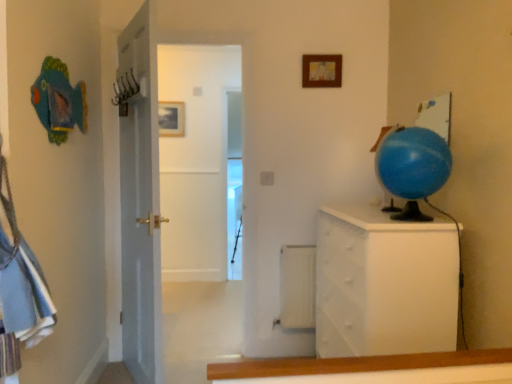
Question: Would you say matte gold picture frame at upper center, positioned as the first picture frame in back-to-front order, is inside or outside white textured chest of drawers at right?

Choices:
 (A) outside
 (B) inside

Answer: (A)

Question: Relative to white textured chest of drawers at right, is matte gold picture frame at upper center, which is the 2th picture frame in right-to-left order, in front or behind?

Choices:
 (A) behind
 (B) front

Answer: (A)

Question: Estimate the real-world distances between objects in this image. Which object is closer to the wooden picture frame at upper center, placed as the 1th picture frame when sorted from front to back?

Choices:
 (A) matte gold picture frame at upper center, marked as the 2th picture frame in a front-to-back arrangement
 (B) white textured chest of drawers at right
 (C) blue rubber globe at right

Answer: (C)

Question: Which object is the closest to the white textured chest of drawers at right?

Choices:
 (A) wooden picture frame at upper center, the 1th picture frame positioned from the right
 (B) matte gold picture frame at upper center, which is the 2th picture frame in right-to-left order
 (C) blue rubber globe at right

Answer: (C)